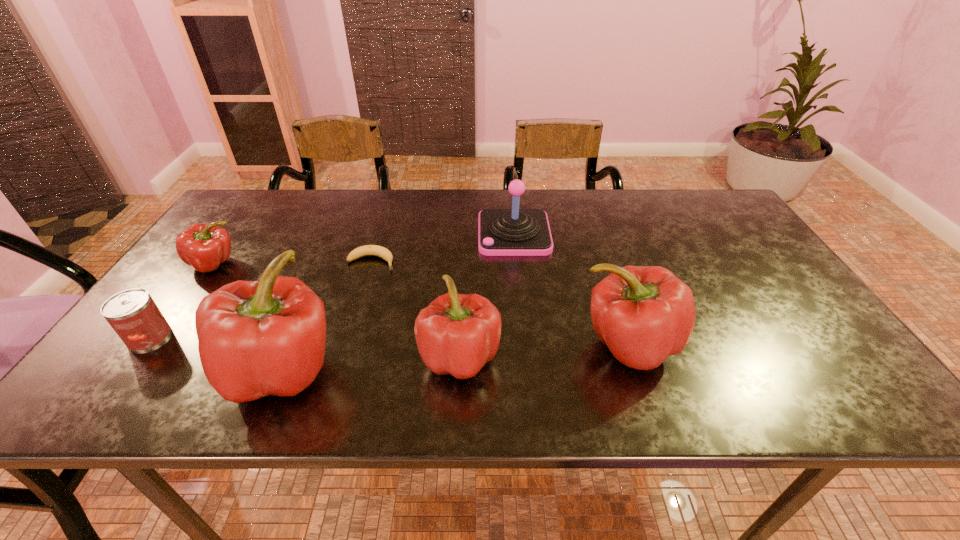
The height and width of the screenshot is (540, 960). Identify the location of empty location between the second shortest bell pepper and the shortest bell pepper. [x=544, y=351].

This screenshot has height=540, width=960. In order to click on vacant space that is in between the joystick and the second bell pepper from right to left in this screenshot , I will do `click(487, 295)`.

Identify the location of free space between the pepper and the can. (181, 300).

Image resolution: width=960 pixels, height=540 pixels. I want to click on vacant area that lies between the banana and the leftmost bell pepper, so click(x=326, y=316).

Point out which object is positioned as the fifth nearest to the rightmost bell pepper. Please provide its 2D coordinates. Your answer should be formatted as a tuple, i.e. [(x, y)], where the tuple contains the x and y coordinates of a point satisfying the conditions above.

[(205, 246)]

Locate an element on the screen. object that is the third closest to the joystick is located at coordinates (456, 334).

Choose which bell pepper is the nearest neighbor to the joystick. Please provide its 2D coordinates. Your answer should be formatted as a tuple, i.e. [(x, y)], where the tuple contains the x and y coordinates of a point satisfying the conditions above.

[(644, 314)]

In order to click on the third closest bell pepper to the joystick in this screenshot , I will do `click(267, 337)`.

I want to click on free point that satisfies the following two spatial constraints: 1. on the front side of the pepper; 2. on the right side of the shortest bell pepper, so click(148, 357).

Where is `vacant position in the image that satisfies the following two spatial constraints: 1. on the front side of the pepper; 2. on the left side of the leftmost bell pepper`? Image resolution: width=960 pixels, height=540 pixels. vacant position in the image that satisfies the following two spatial constraints: 1. on the front side of the pepper; 2. on the left side of the leftmost bell pepper is located at coordinates (138, 370).